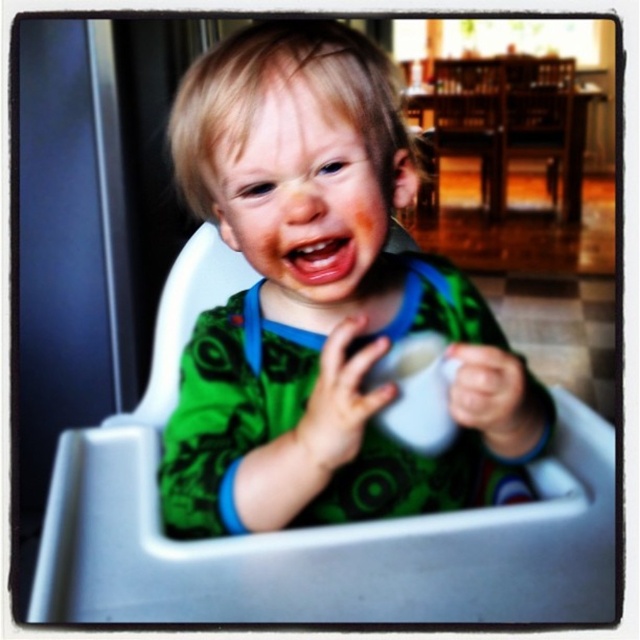
You are a photographer trying to capture the child in the high chair. You need to focus your camera on the green matte shirt at center. What coordinates should you adjust your camera to?

You should adjust your camera to the coordinates point (321, 301) to focus on the green matte shirt at center.

You are a caregiver trying to ensure the child in the high chair is comfortable. The green matte shirt at center and the white plastic feeding chair at center are both in the center of the image. Which object takes up more space in the image?

The white plastic feeding chair at center takes up more space in the image because it is larger than the green matte shirt at center.